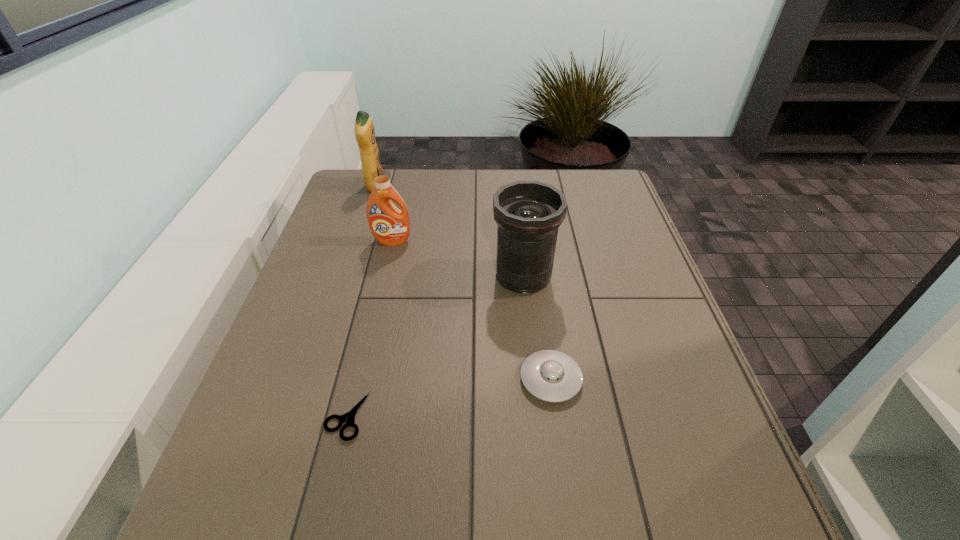
This screenshot has width=960, height=540. I want to click on the leftmost object, so click(364, 130).

Where is `the farther detergent`? Image resolution: width=960 pixels, height=540 pixels. the farther detergent is located at coordinates (364, 130).

Image resolution: width=960 pixels, height=540 pixels. What are the coordinates of `the third nearest object` in the screenshot? It's located at (528, 213).

At what (x,y) coordinates should I click in order to perform the action: click on the shorter detergent. Please return your answer as a coordinate pair (x, y). This screenshot has height=540, width=960. Looking at the image, I should click on (390, 226).

At what (x,y) coordinates should I click in order to perform the action: click on the nearer detergent. Please return your answer as a coordinate pair (x, y). Image resolution: width=960 pixels, height=540 pixels. Looking at the image, I should click on (390, 226).

This screenshot has width=960, height=540. I want to click on the second shortest object, so click(551, 376).

Locate an element on the screen. shears is located at coordinates pyautogui.click(x=348, y=418).

At what (x,y) coordinates should I click in order to perform the action: click on free location located 0.060m on the label of the left detergent. Please return your answer as a coordinate pair (x, y). The width and height of the screenshot is (960, 540). Looking at the image, I should click on (402, 187).

Find the location of a particular element. Image resolution: width=960 pixels, height=540 pixels. free point located 0.170m on the front of the third farthest object is located at coordinates (532, 355).

At what (x,y) coordinates should I click in order to perform the action: click on free space located 0.130m on the front-facing side of the nearer detergent. Please return your answer as a coordinate pair (x, y). Looking at the image, I should click on (383, 278).